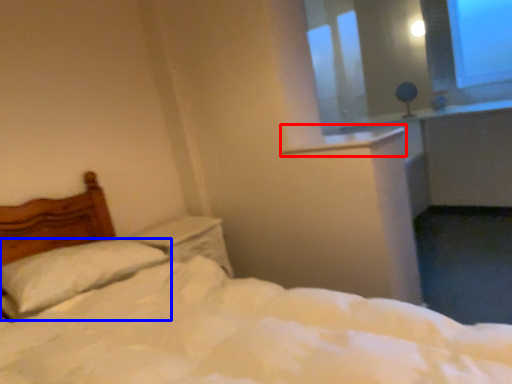
Question: Which object appears farthest to the camera in this image, window sill (highlighted by a red box) or pillow (highlighted by a blue box)?

Choices:
 (A) window sill
 (B) pillow

Answer: (A)